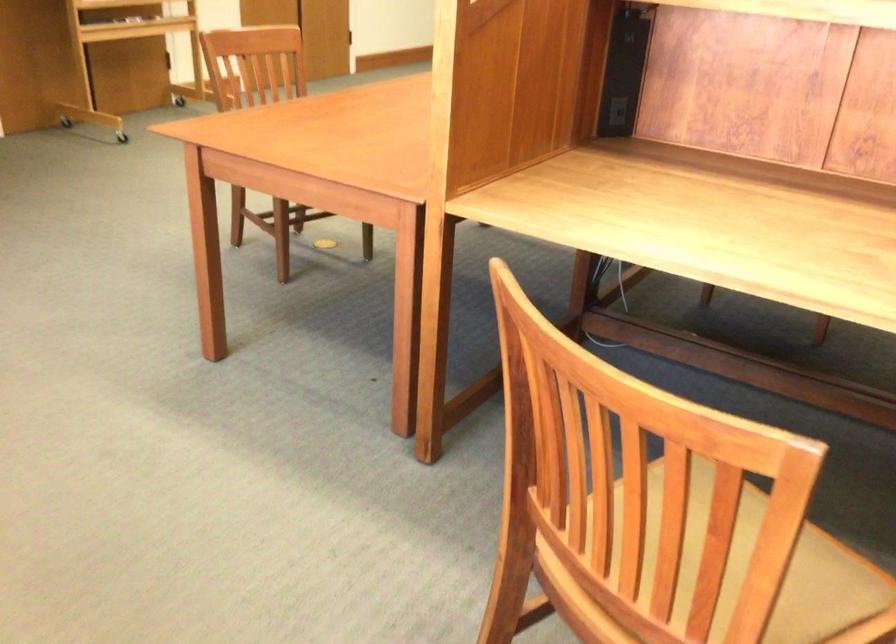
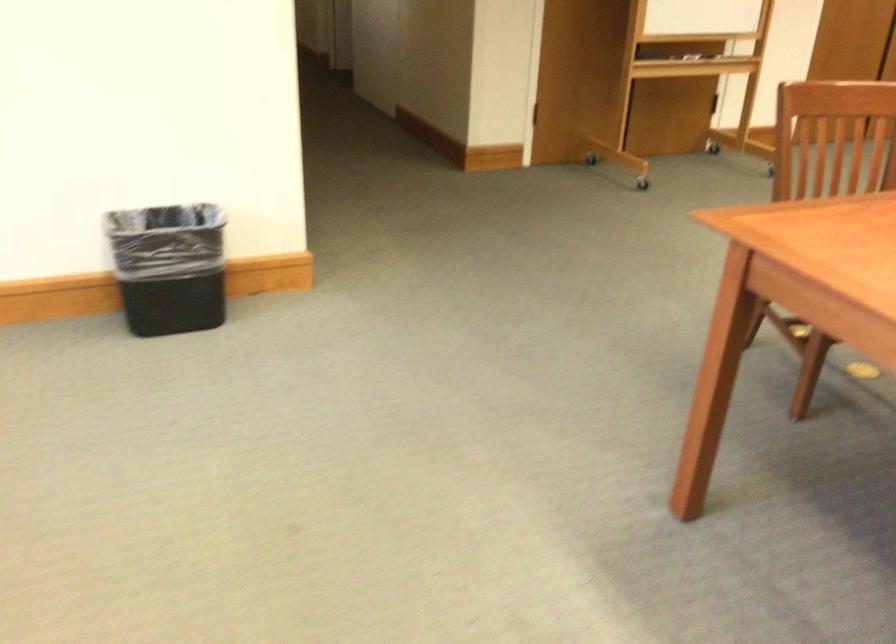
The point at (78, 109) is marked in the first image. Where is the corresponding point in the second image?

(595, 153)